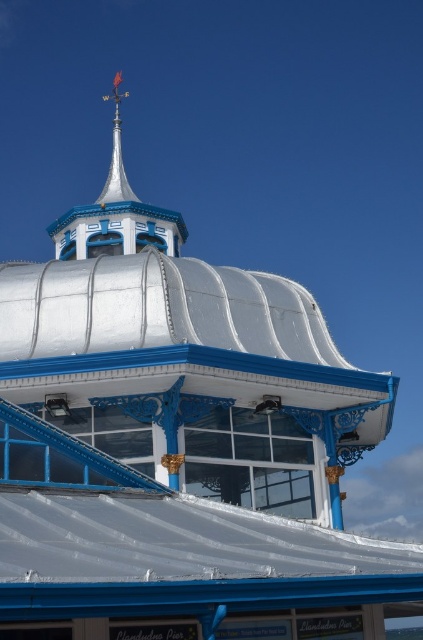
Measure the distance from shiny blue spire at upper center to shiny silver spire at top.

2.82 meters

Is point (104, 218) positioned after point (115, 152)?

No.

This screenshot has width=423, height=640. I want to click on shiny blue spire at upper center, so click(x=115, y=212).